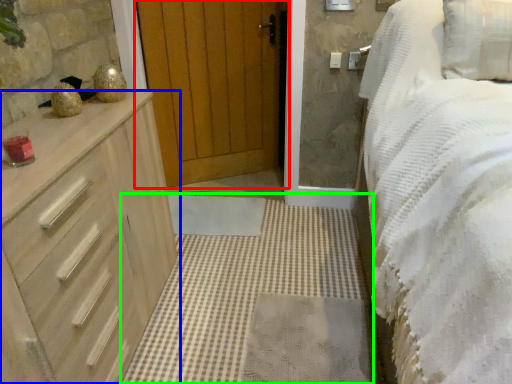
Question: Which object is positioned farthest from door (highlighted by a red box)? Select from chest of drawers (highlighted by a blue box) and plain (highlighted by a green box).

Choices:
 (A) chest of drawers
 (B) plain

Answer: (A)